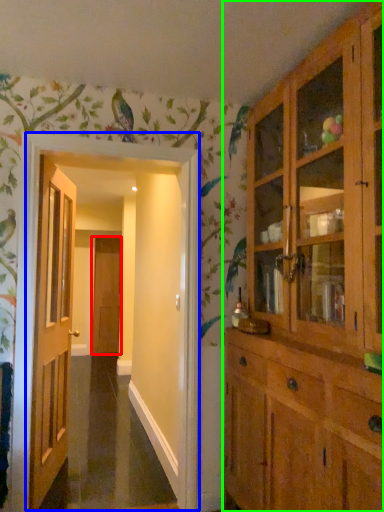
Question: Estimate the real-world distances between objects in this image. Which object is closer to door (highlighted by a red box), corridor (highlighted by a blue box) or cabinetry (highlighted by a green box)?

Choices:
 (A) corridor
 (B) cabinetry

Answer: (A)